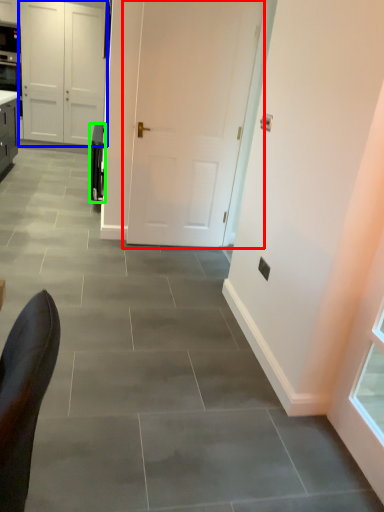
Question: Estimate the real-world distances between objects in this image. Which object is farther from door (highlighted by a red box), door (highlighted by a blue box) or appliance (highlighted by a green box)?

Choices:
 (A) door
 (B) appliance

Answer: (A)